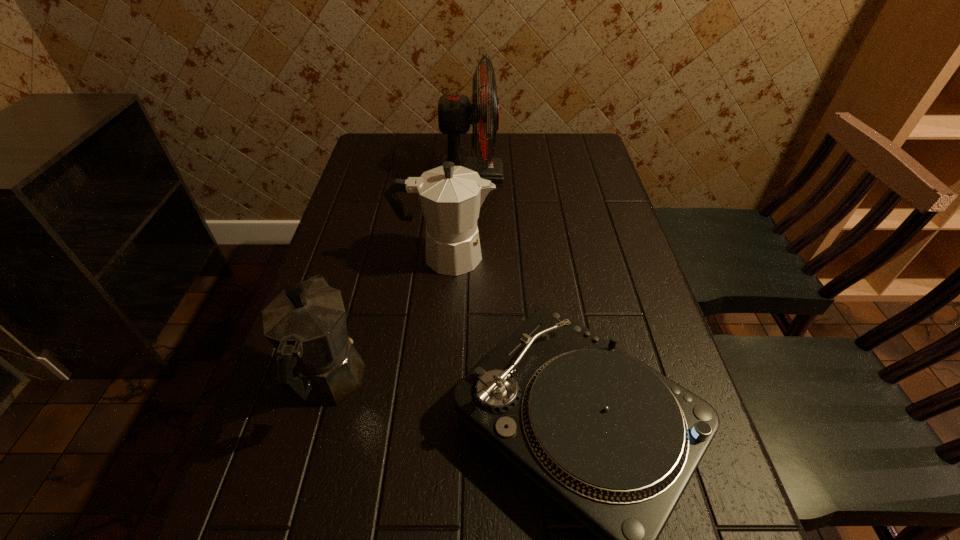
Point out which object is positioned as the nearest to the shortest object. Please provide its 2D coordinates. Your answer should be formatted as a tuple, i.e. [(x, y)], where the tuple contains the x and y coordinates of a point satisfying the conditions above.

[(451, 196)]